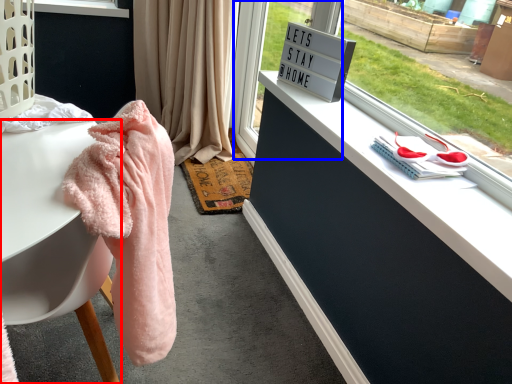
Question: Among these objects, which one is nearest to the camera, desk (highlighted by a red box) or glass door (highlighted by a blue box)?

Choices:
 (A) desk
 (B) glass door

Answer: (A)